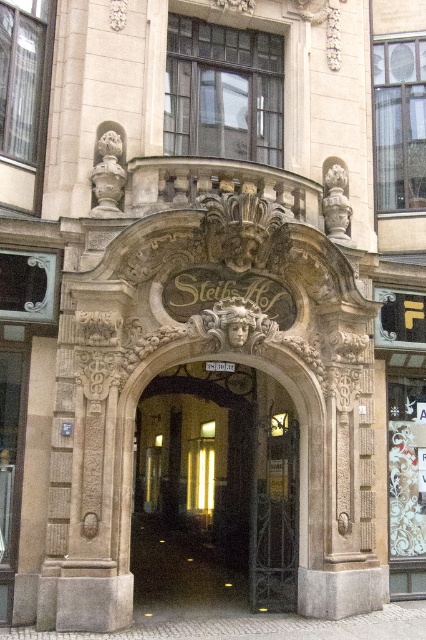
Who is more forward, (209, 468) or (201, 582)?

Point (201, 582)

Can you confirm if dark brown stone archway at center is positioned above matte glass door at center?

Incorrect, dark brown stone archway at center is not positioned above matte glass door at center.

The width and height of the screenshot is (426, 640). Find the location of `dark brown stone archway at center`. dark brown stone archway at center is located at coordinates (218, 480).

Locate an element on the screen. This screenshot has width=426, height=640. dark brown stone archway at center is located at coordinates (218, 480).